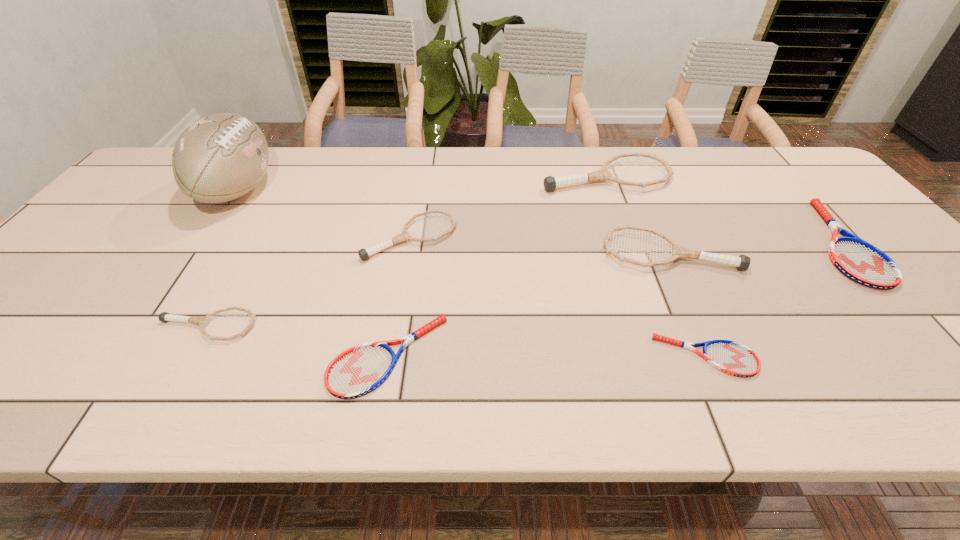
Select which object is the seventh closest to the second blue tennis racket from left to right. Please provide its 2D coordinates. Your answer should be formatted as a tuple, i.e. [(x, y)], where the tuple contains the x and y coordinates of a point satisfying the conditions above.

[(221, 157)]

Locate which tennis racket ranks fourth in proximity to the shortest object. Please provide its 2D coordinates. Your answer should be formatted as a tuple, i.e. [(x, y)], where the tuple contains the x and y coordinates of a point satisfying the conditions above.

[(364, 254)]

The width and height of the screenshot is (960, 540). I want to click on tennis racket that stands as the second closest to the farthest blue tennis racket, so click(x=550, y=183).

Select which gray tennis racket is the third closest to the fifth shortest tennis racket. Please provide its 2D coordinates. Your answer should be formatted as a tuple, i.e. [(x, y)], where the tuple contains the x and y coordinates of a point satisfying the conditions above.

[(742, 262)]

The height and width of the screenshot is (540, 960). What are the coordinates of `the third closest gray tennis racket to the second gray tennis racket from left to right` in the screenshot? It's located at (742, 262).

Where is `blue tennis racket that is the third closest one to the football (American)`? This screenshot has width=960, height=540. blue tennis racket that is the third closest one to the football (American) is located at coordinates (860, 261).

Identify which blue tennis racket is the third nearest to the second smallest gray tennis racket. Please provide its 2D coordinates. Your answer should be formatted as a tuple, i.e. [(x, y)], where the tuple contains the x and y coordinates of a point satisfying the conditions above.

[(860, 261)]

Identify the location of free space that satisfies the following two spatial constraints: 1. on the back side of the third tallest object; 2. on the right side of the farthest blue tennis racket. (665, 243).

Identify the location of vacant point that satisfies the following two spatial constraints: 1. on the back side of the smallest gray tennis racket; 2. on the right side of the biggest gray tennis racket. The image size is (960, 540). (291, 177).